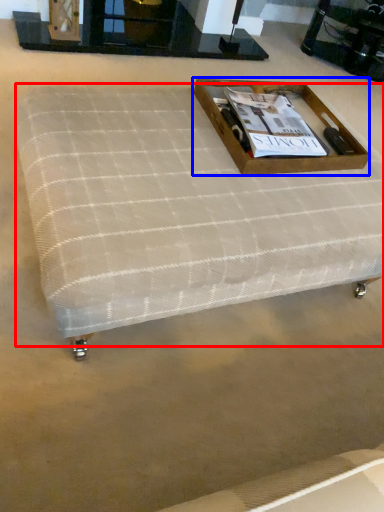
Question: Which object is further to the camera taking this photo, mattress (highlighted by a red box) or box (highlighted by a blue box)?

Choices:
 (A) mattress
 (B) box

Answer: (B)